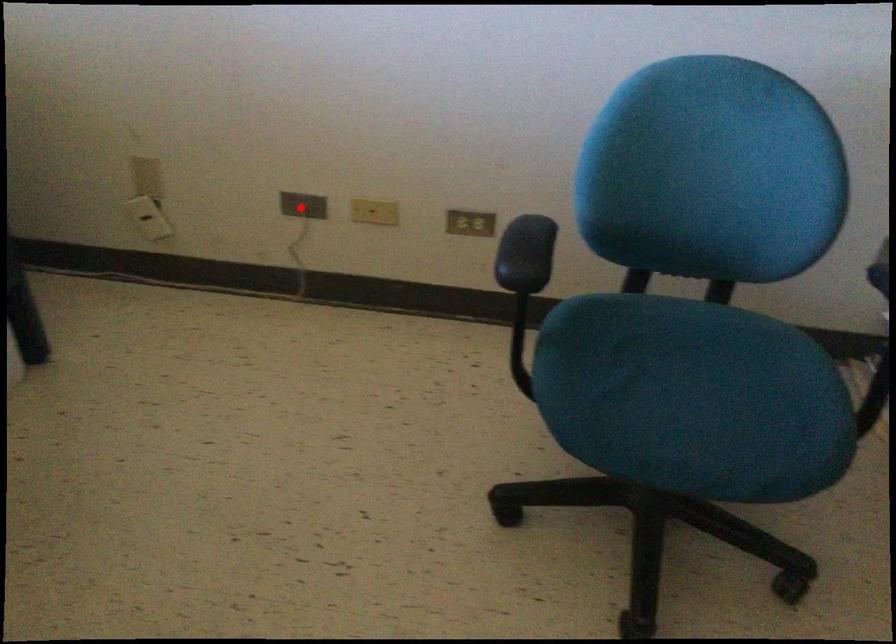
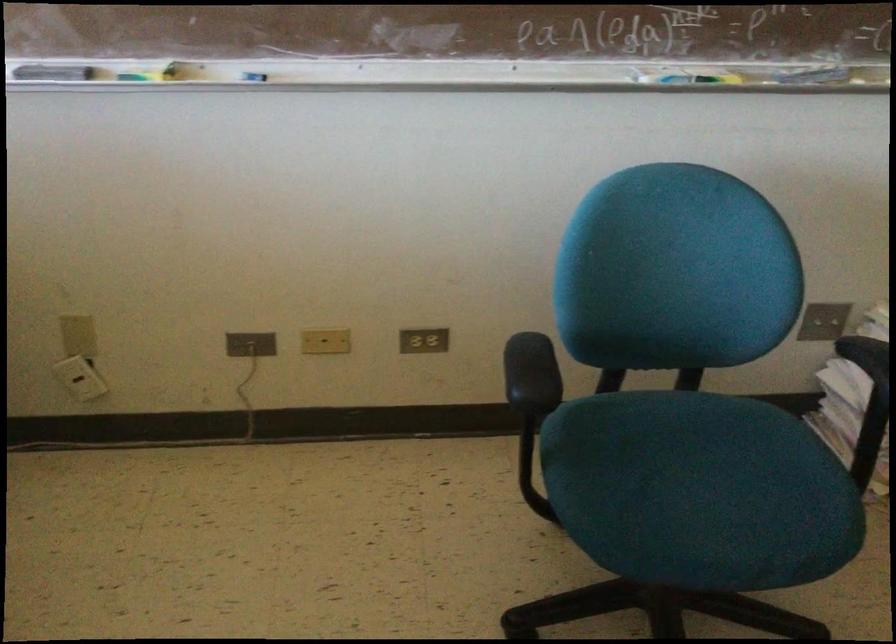
Find the pixel in the second image that matches the highlighted location in the first image.

(250, 344)